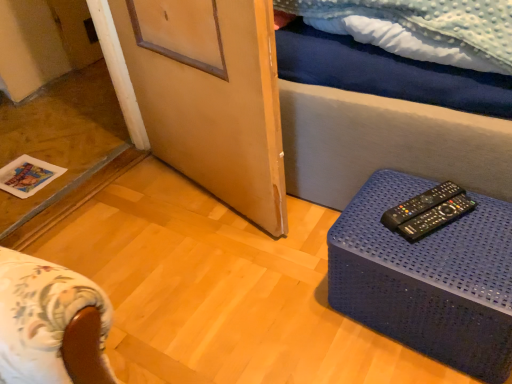
You are a GUI agent. You are given a task and a screenshot of the screen. Output one action in this format:
    pyautogui.click(x=<x>, y=<y>)
    Task: Click on the free point behind black plastic remote control at right, positioned as the 1th remote control in back-to-front order
    The height and width of the screenshot is (384, 512).
    Given the screenshot: What is the action you would take?
    click(x=401, y=181)